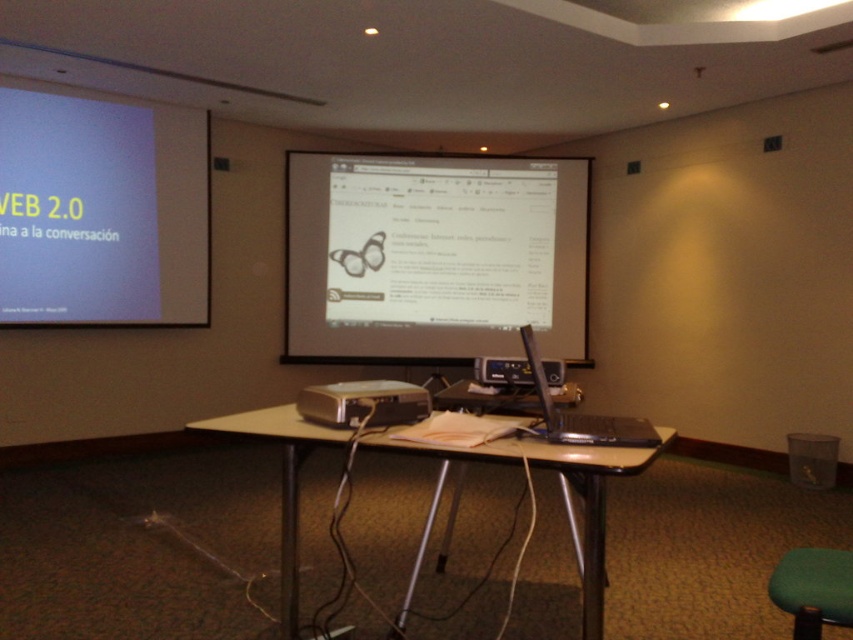
You are setting up a presentation in the conference room. You have a matte white projector screen at center and a black plastic projector at center. Which one is located to the right of the other?

The matte white projector screen at center is positioned on the right side of the black plastic projector at center, so the screen is to the right of the projector.

Based on the photo, you are setting up a presentation in the conference room and need to place a large banner between the matte white projector screen at center and the metallic silver table at center. Based on their sizes, which object should the banner be placed closer to?

The matte white projector screen at center has a larger width than the metallic silver table at center, so the banner should be placed closer to the matte white projector screen at center to ensure proper alignment and visibility.

You are standing at the point marked as point (338, 412) in the conference room. You need to move to the nearest projection screen. Which one should you go to?

Both screens are 2.04 meters away from point (338, 412), so you can choose either one as they are equidistant.